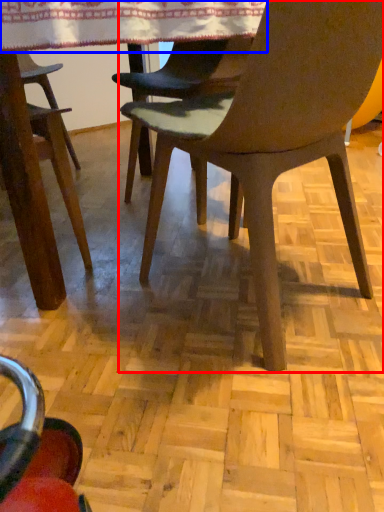
Question: Which of the following is the farthest to the observer, chair (highlighted by a red box) or tablecloth (highlighted by a blue box)?

Choices:
 (A) chair
 (B) tablecloth

Answer: (B)